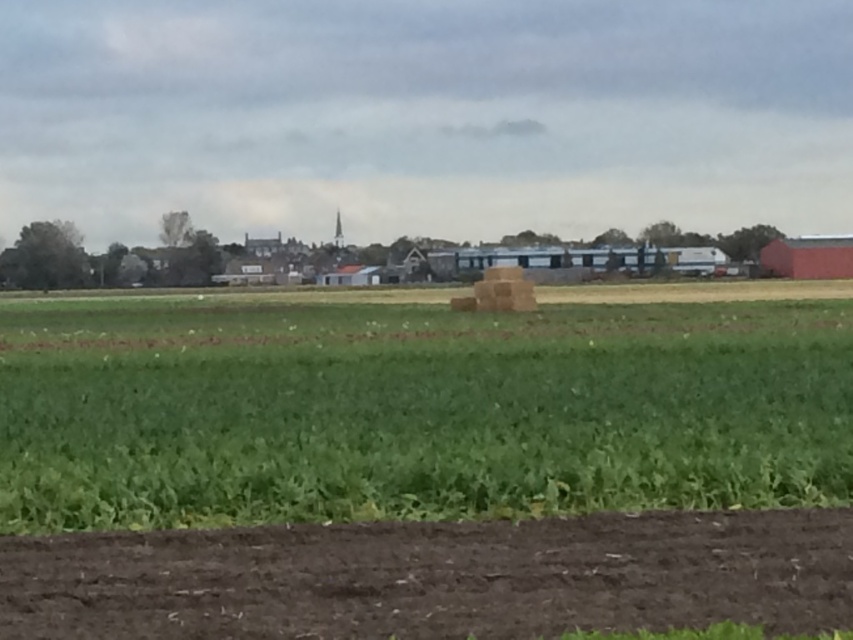
Question: Does green grassy field at center lie behind brown soil at lower center?

Choices:
 (A) no
 (B) yes

Answer: (B)

Question: Is green grassy field at center closer to the viewer compared to brown soil at lower center?

Choices:
 (A) no
 (B) yes

Answer: (A)

Question: Which object appears closest to the camera in this image?

Choices:
 (A) brown soil at lower center
 (B) green grassy field at center

Answer: (A)

Question: Which object is closer to the camera taking this photo?

Choices:
 (A) green grassy field at center
 (B) brown soil at lower center

Answer: (B)

Question: Does green grassy field at center have a larger size compared to brown soil at lower center?

Choices:
 (A) yes
 (B) no

Answer: (A)